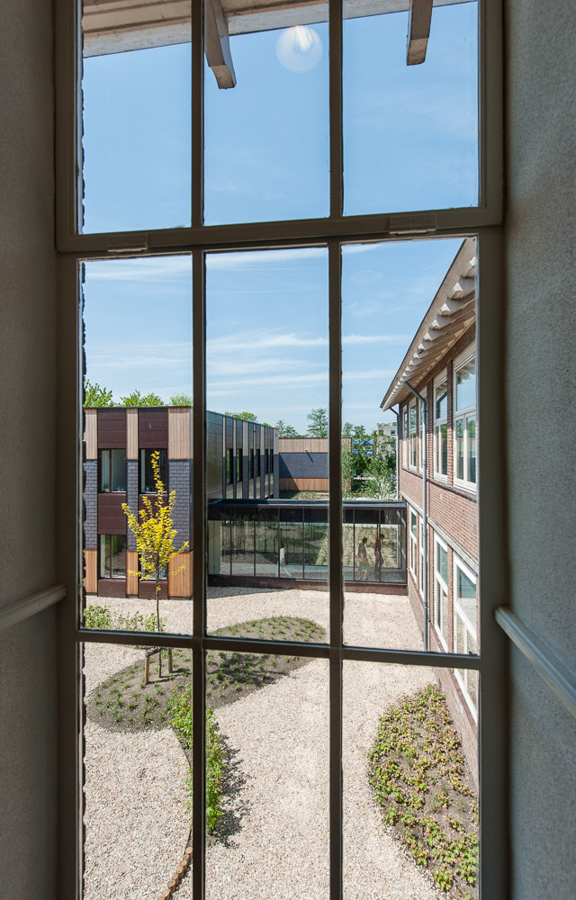
Where is `white window frames`? white window frames is located at coordinates (438, 554), (458, 579).